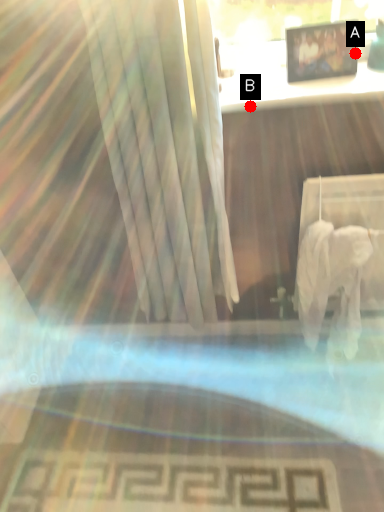
Question: Two points are circled on the image, labeled by A and B beside each circle. Among these points, which one is farthest from the camera?

Choices:
 (A) A is further
 (B) B is further

Answer: (A)